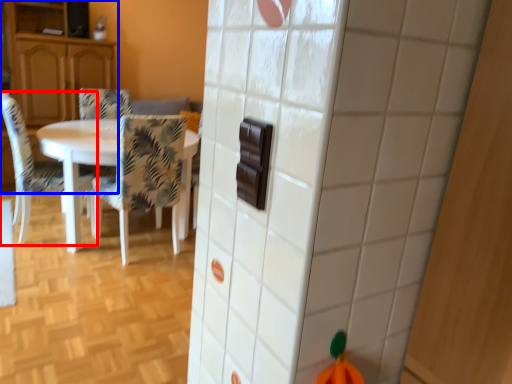
Question: Which object appears farthest to the camera in this image, chair (highlighted by a red box) or cabinetry (highlighted by a blue box)?

Choices:
 (A) chair
 (B) cabinetry

Answer: (B)